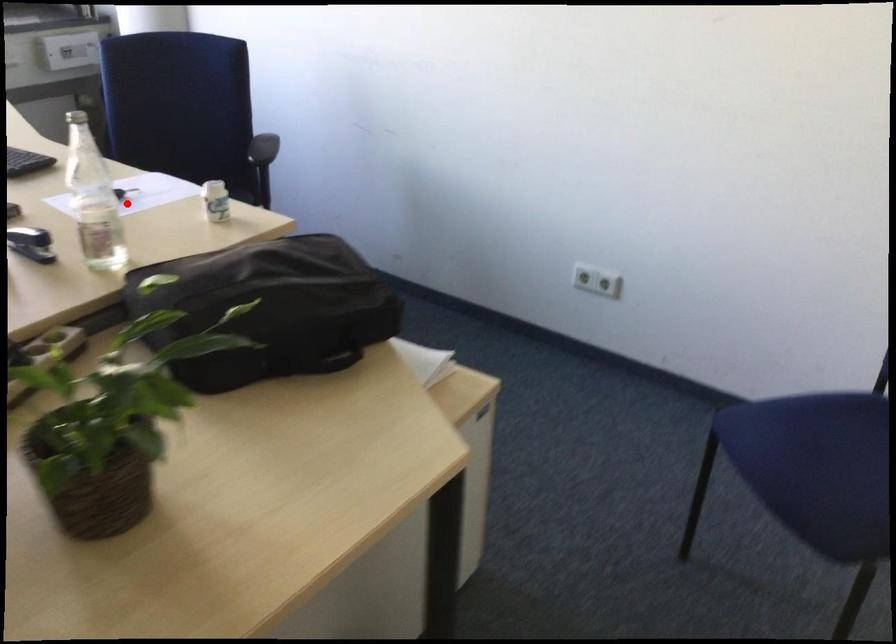
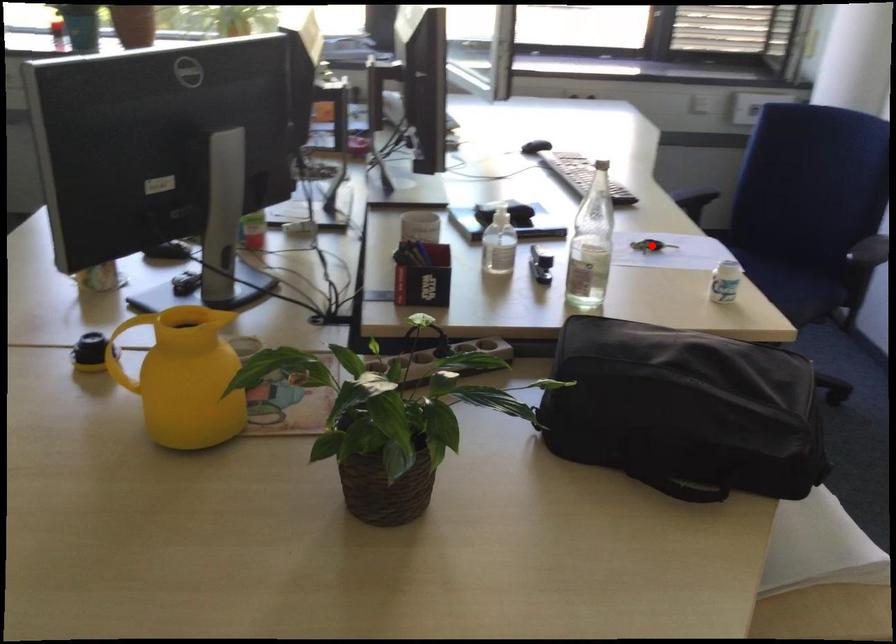
I am providing you with two images of the same scene from different viewpoints. A red point is marked on the first image and another point is marked on the second image. Are the points marked in image1 and image2 representing the same 3D position?

Yes